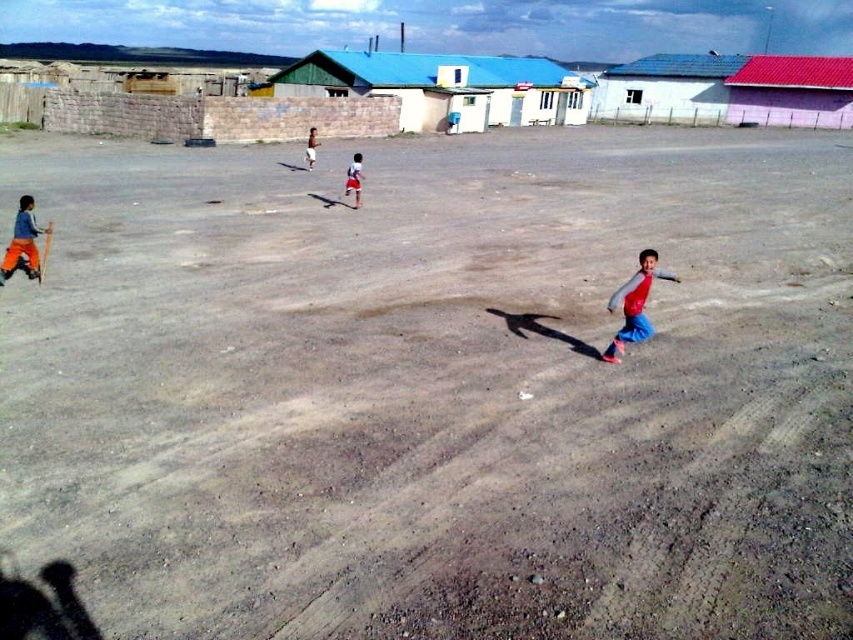
You are a photographer trying to capture a photo of the children playing in the dusty area. You notice the red fabric shirt at center and the red fabric shorts at center. Which one should you focus on if you want to capture the object that is taller?

The red fabric shirt at center is much taller than the red fabric shorts at center, so you should focus on the red fabric shirt at center to capture the taller object.

You are a parent trying to locate your two children in the dusty area. The red cotton shirt at lower right and the brushed orange pants at lower left are the only visible clothing items. Can you safely assume they are within a 10 meter distance of each other?

The red cotton shirt at lower right and the brushed orange pants at lower left are 8.50 meters apart from each other, so yes, they are within the 10 meter distance.